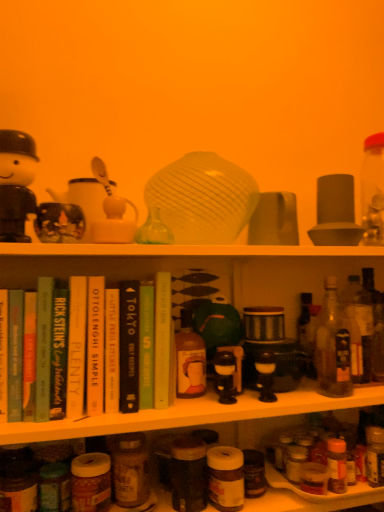
Locate an element on the screen. vacant area situated to the left side of translucent glass bottle at lower right, marked as the fourth bottle in a left-to-right arrangement is located at coordinates (313, 476).